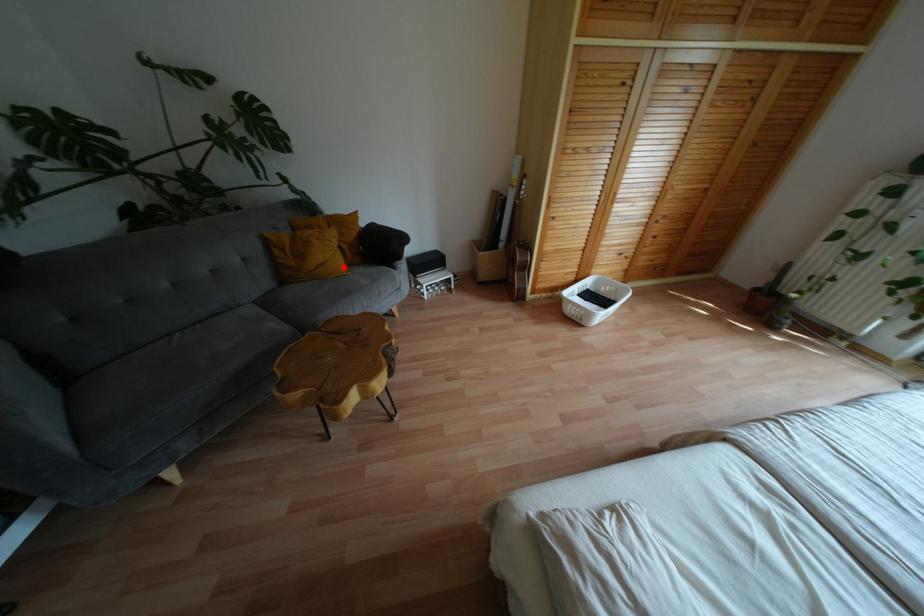
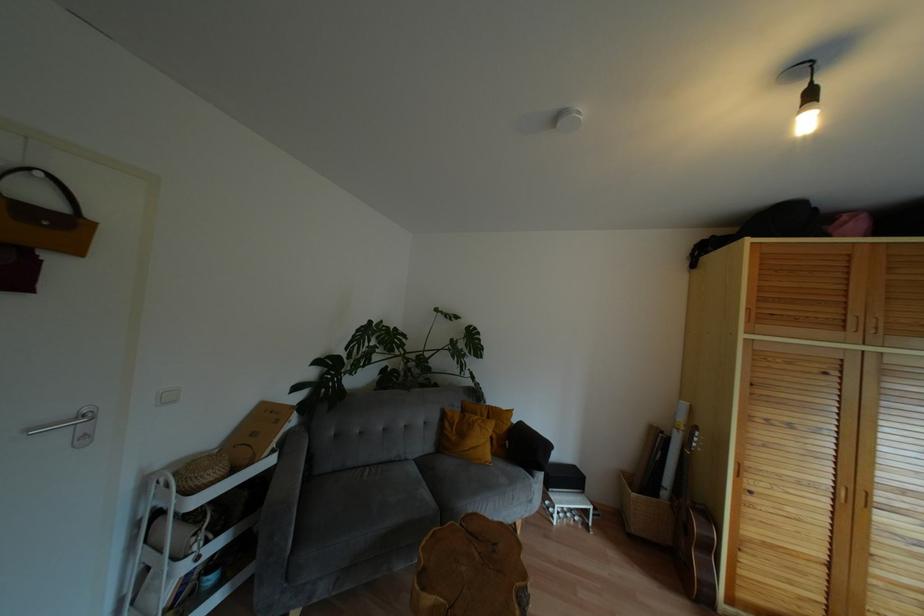
Where in the second image is the point corresponding to the highlighted location from the first image?

(488, 456)